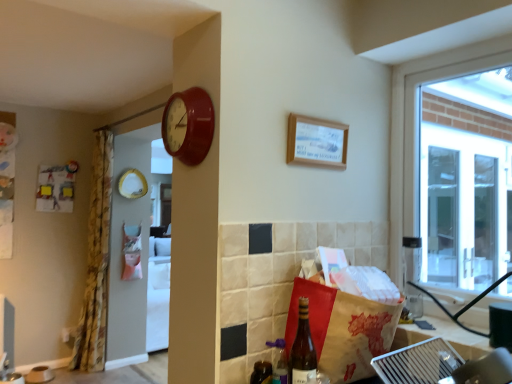
Question: Considering their positions, is shiny dark brown bottle at lower center, marked as the 1th bottle in a back-to-front arrangement, located in front of or behind translucent glass bottle at lower center, acting as the first bottle starting from the front?

Choices:
 (A) behind
 (B) front

Answer: (A)

Question: In terms of size, does shiny dark brown bottle at lower center, marked as the 1th bottle in a back-to-front arrangement, appear bigger or smaller than translucent glass bottle at lower center, acting as the first bottle starting from the front?

Choices:
 (A) big
 (B) small

Answer: (B)

Question: Estimate the real-world distances between objects in this image. Which object is closer to the translucent glass bottle at lower center, acting as the first bottle starting from the front?

Choices:
 (A) matte red clock at upper center
 (B) shiny dark brown bottle at lower center, marked as the 1th bottle in a back-to-front arrangement
 (C) brown paper bag at lower right
 (D) wooden frame at upper center
 (E) floral fabric curtain at left

Answer: (B)

Question: Considering the real-world distances, which object is closest to the wooden frame at upper center?

Choices:
 (A) floral fabric curtain at left
 (B) translucent glass bottle at lower right
 (C) brown paper bag at lower right
 (D) translucent glass bottle at lower center, the second bottle viewed from the back
 (E) matte red clock at upper center

Answer: (E)